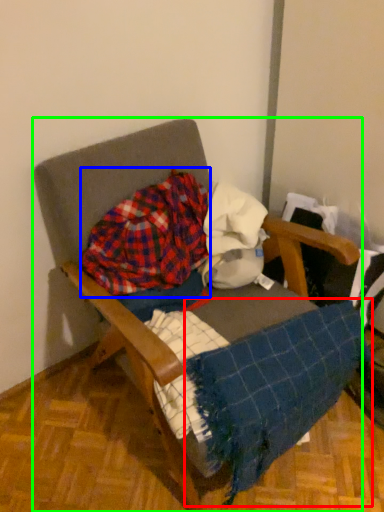
Question: Based on their relative distances, which object is farther from blanket (highlighted by a red box)? Choose from flannel (highlighted by a blue box) and furniture (highlighted by a green box).

Choices:
 (A) flannel
 (B) furniture

Answer: (A)